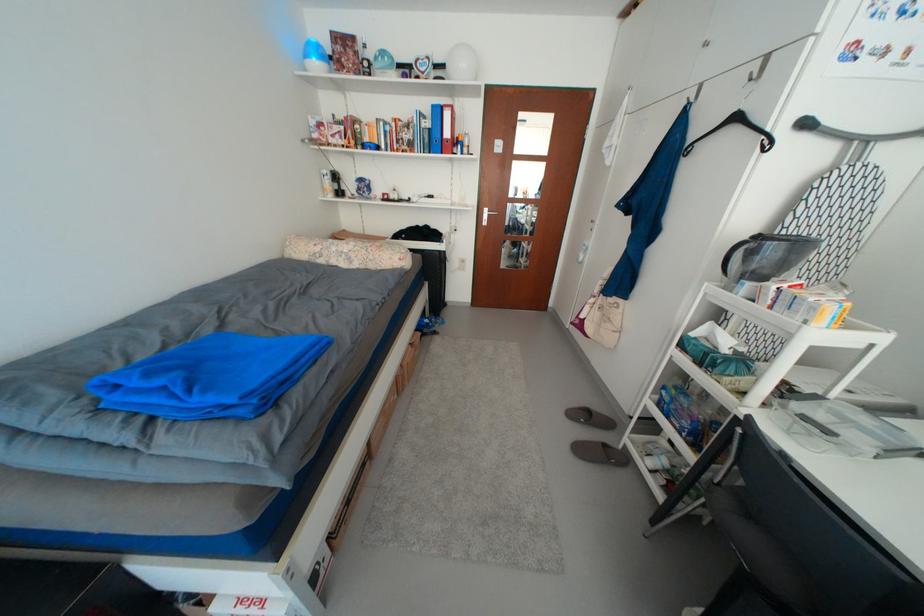
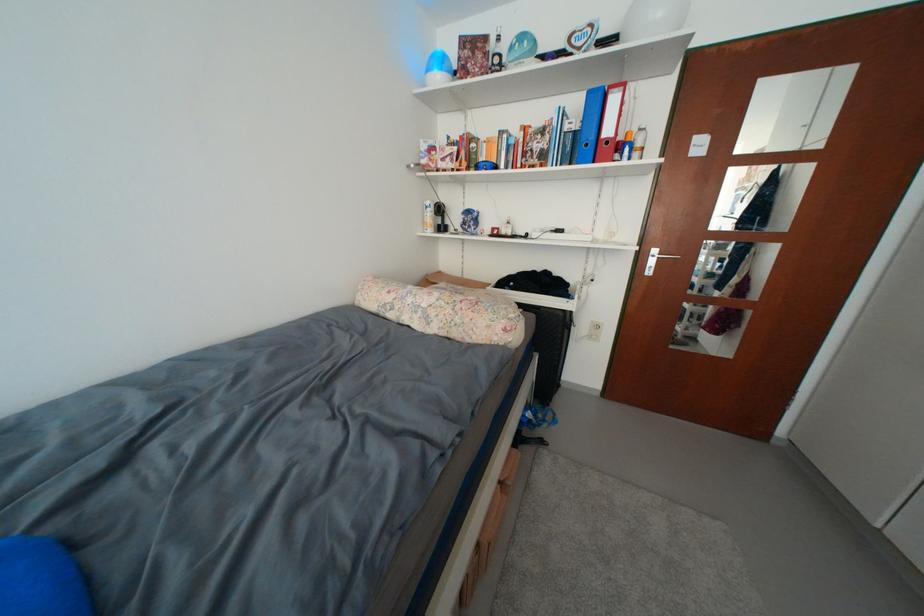
Locate, in the second image, the point that corresponds to (x=333, y=191) in the first image.

(432, 225)